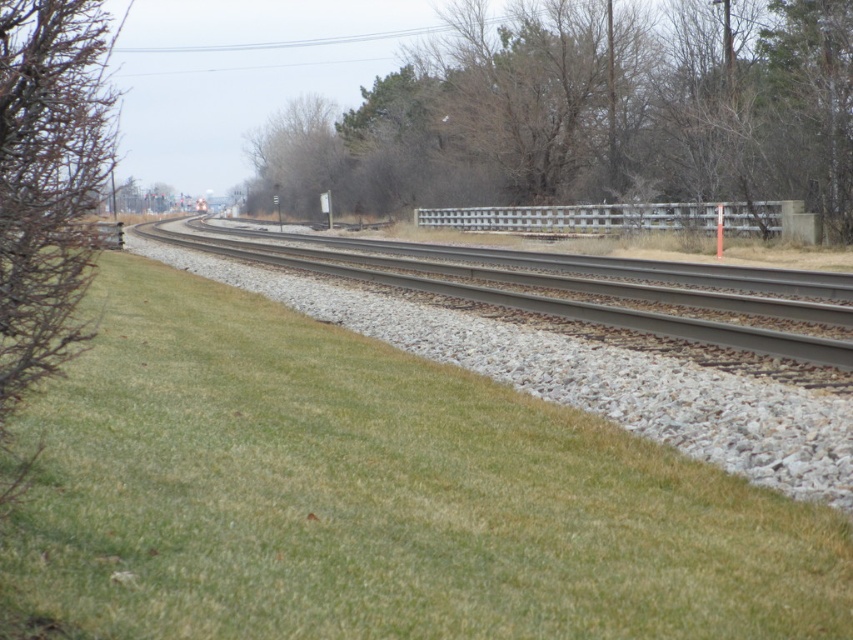
You are a landscape architect designing a railway path. You need to determine which area requires more maintenance between the green grassy at center and the brown textured bush at left. Based on their sizes, which one should you prioritize?

Answer: The brown textured bush at left requires more maintenance because it is larger than the green grassy at center.